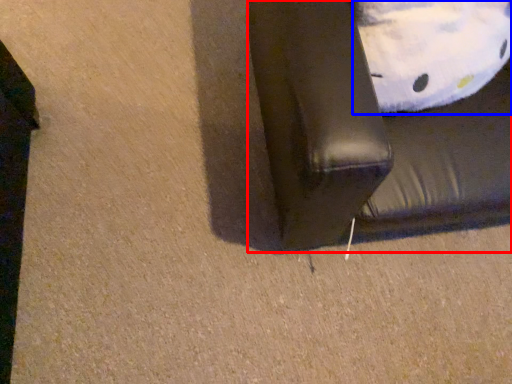
Question: Which object is closer to the camera taking this photo, furniture (highlighted by a red box) or pillow (highlighted by a blue box)?

Choices:
 (A) furniture
 (B) pillow

Answer: (A)